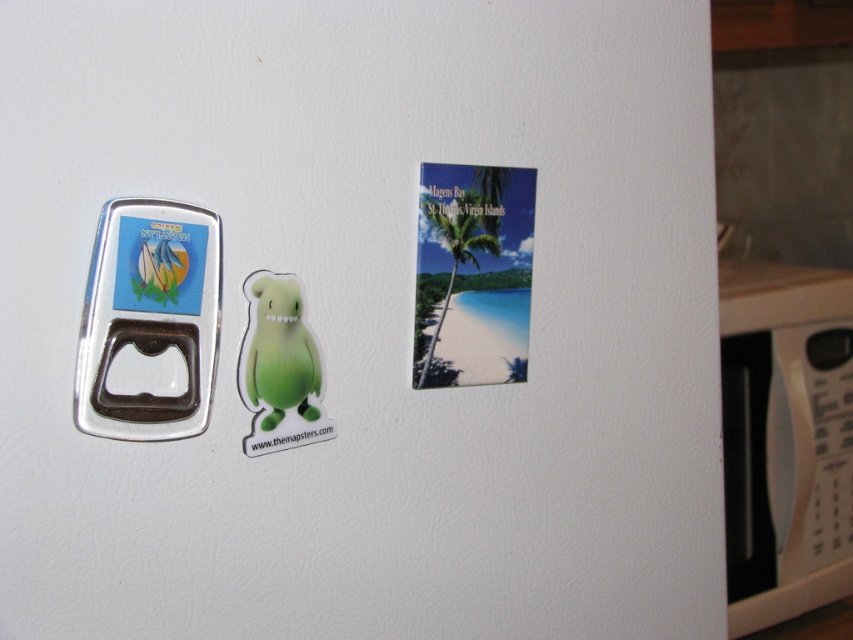
Between point (836, 348) and point (109, 294), which one is positioned behind?

Point (836, 348)

Who is positioned more to the right, white plastic microwave at right or metallic silver bottle opener at left?

Positioned to the right is white plastic microwave at right.

Between point (755, 620) and point (167, 397), which one is positioned in front?

Positioned in front is point (167, 397).

The height and width of the screenshot is (640, 853). What are the coordinates of `white plastic microwave at right` in the screenshot? It's located at (785, 440).

Is white plastic microwave at right positioned before green rubber toy at center?

No, it is behind green rubber toy at center.

From the picture: Between white plastic microwave at right and green rubber toy at center, which one has more height?

Standing taller between the two is white plastic microwave at right.

Between point (757, 364) and point (277, 298), which one is positioned in front?

Point (277, 298) is in front.

At what (x,y) coordinates should I click in order to perform the action: click on white plastic microwave at right. Please return your answer as a coordinate pair (x, y). Image resolution: width=853 pixels, height=640 pixels. Looking at the image, I should click on (785, 440).

Is metallic silver bottle opener at left behind green rubber toy at center?

No, metallic silver bottle opener at left is in front of green rubber toy at center.

How distant is metallic silver bottle opener at left from green rubber toy at center?

They are 8.85 centimeters apart.

Is point (131, 225) positioned in front of point (270, 422)?

Yes.

You are a GUI agent. You are given a task and a screenshot of the screen. Output one action in this format:
    pyautogui.click(x=<x>, y=<y>)
    Task: Click on the metallic silver bottle opener at left
    The height and width of the screenshot is (640, 853).
    Given the screenshot: What is the action you would take?
    pyautogui.click(x=149, y=316)